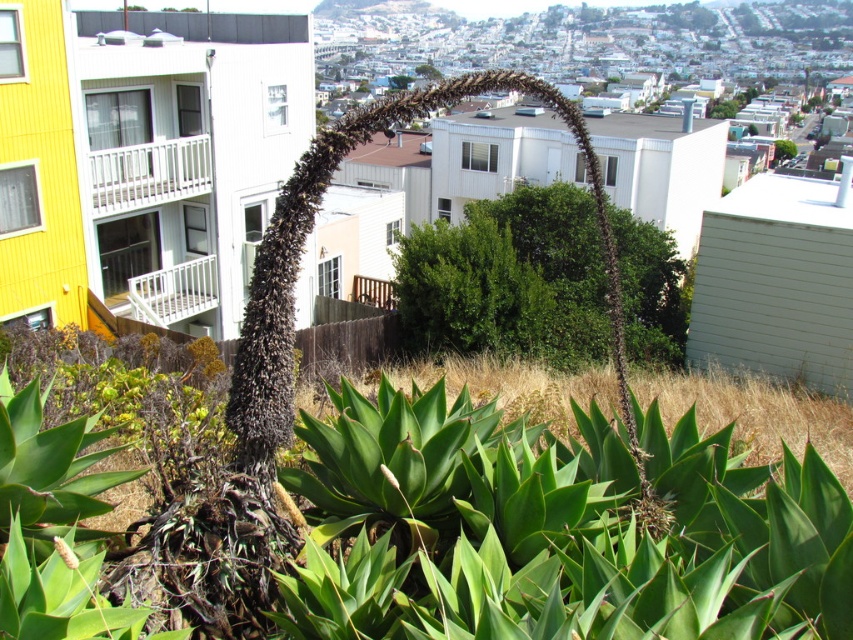
You are standing in the urban landscape and want to place a new green leafy bush exactly at point (508,280). According to the scene description, is this location already occupied by an object?

Yes, the location at point (508,280) is already occupied by the green leafy bush at center.

You are a gardener planning to trim the green leafy bush at center and the green leafy tree at upper center. Which one should you tackle first if you want to work from the closest to farthest distance?

You should trim the green leafy bush at center first because it is in front of the green leafy tree at upper center, making it closer to you.